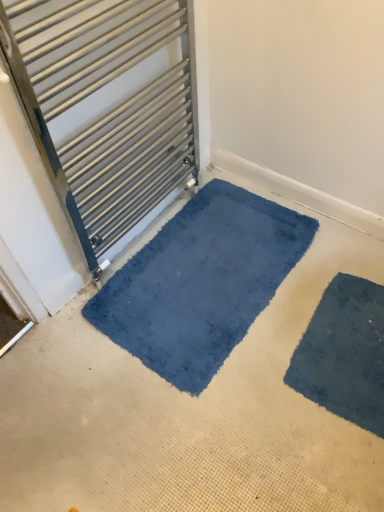
Question: From the image's perspective, does blue plush mat at lower center appear lower than satin silver towel rail at upper left?

Choices:
 (A) no
 (B) yes

Answer: (B)

Question: Is blue plush mat at lower center aimed at satin silver towel rail at upper left?

Choices:
 (A) yes
 (B) no

Answer: (B)

Question: Is blue plush mat at lower center turned away from satin silver towel rail at upper left?

Choices:
 (A) no
 (B) yes

Answer: (A)

Question: Does blue plush mat at lower center have a lesser width compared to satin silver towel rail at upper left?

Choices:
 (A) yes
 (B) no

Answer: (B)

Question: Can you confirm if blue plush mat at lower center is wider than satin silver towel rail at upper left?

Choices:
 (A) no
 (B) yes

Answer: (B)

Question: Can we say blue plush mat at lower center lies outside satin silver towel rail at upper left?

Choices:
 (A) yes
 (B) no

Answer: (A)

Question: Is blue soft carpet at center oriented towards satin silver towel rail at upper left?

Choices:
 (A) no
 (B) yes

Answer: (A)

Question: From a real-world perspective, does blue soft carpet at center stand above satin silver towel rail at upper left?

Choices:
 (A) yes
 (B) no

Answer: (B)

Question: Would you say blue soft carpet at center is a long distance from satin silver towel rail at upper left?

Choices:
 (A) no
 (B) yes

Answer: (A)

Question: From the image's perspective, is blue soft carpet at center located beneath satin silver towel rail at upper left?

Choices:
 (A) no
 (B) yes

Answer: (B)

Question: Can you confirm if blue soft carpet at center is taller than satin silver towel rail at upper left?

Choices:
 (A) no
 (B) yes

Answer: (A)

Question: Considering the relative positions of blue soft carpet at center and satin silver towel rail at upper left in the image provided, is blue soft carpet at center to the left of satin silver towel rail at upper left from the viewer's perspective?

Choices:
 (A) yes
 (B) no

Answer: (B)

Question: Is dark blue plush bath mat at lower right turned away from blue soft carpet at center?

Choices:
 (A) yes
 (B) no

Answer: (A)